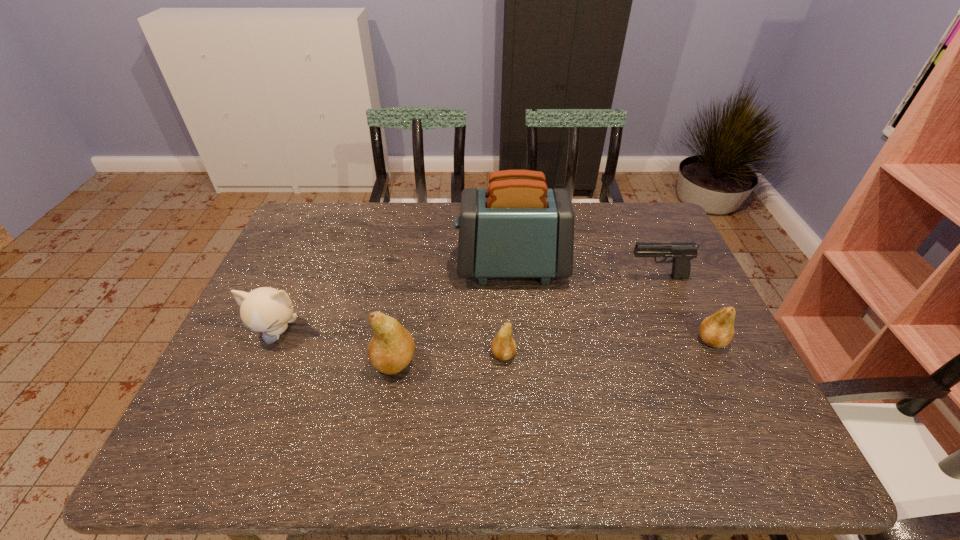
Where is `blank region between the toaster and the shortest pear`? The image size is (960, 540). blank region between the toaster and the shortest pear is located at coordinates (508, 311).

This screenshot has height=540, width=960. What are the coordinates of `unoccupied position between the leftmost object and the leftmost pear` in the screenshot? It's located at (335, 347).

The image size is (960, 540). Identify the location of free spot between the second tallest pear and the tallest pear. coord(553,352).

Identify the location of vacant area that lies between the shortest pear and the pistol. (581, 316).

Identify which object is the second nearest to the leftmost pear. Please provide its 2D coordinates. Your answer should be formatted as a tuple, i.e. [(x, y)], where the tuple contains the x and y coordinates of a point satisfying the conditions above.

[(268, 310)]

Identify which object is the fifth nearest to the kitten. Please provide its 2D coordinates. Your answer should be formatted as a tuple, i.e. [(x, y)], where the tuple contains the x and y coordinates of a point satisfying the conditions above.

[(717, 330)]

Identify which pear is located as the second nearest to the toaster. Please provide its 2D coordinates. Your answer should be formatted as a tuple, i.e. [(x, y)], where the tuple contains the x and y coordinates of a point satisfying the conditions above.

[(391, 349)]

Locate an element on the screen. This screenshot has height=540, width=960. pear that is the closest to the toaster is located at coordinates (503, 346).

Find the location of a particular element. This screenshot has height=540, width=960. free space that satisfies the following two spatial constraints: 1. aim along the barrel of the second shortest pear; 2. on the right side of the pistol is located at coordinates 684,341.